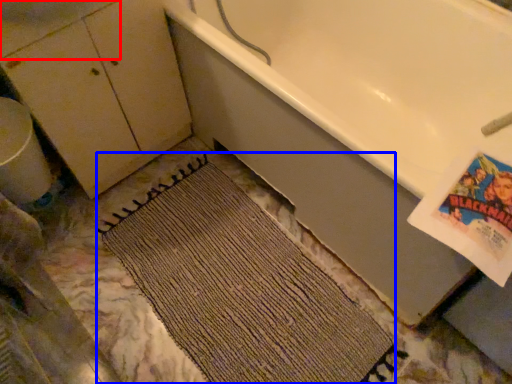
Question: Which point is closer to the camera, sink (highlighted by a red box) or doormat (highlighted by a blue box)?

Choices:
 (A) sink
 (B) doormat

Answer: (A)